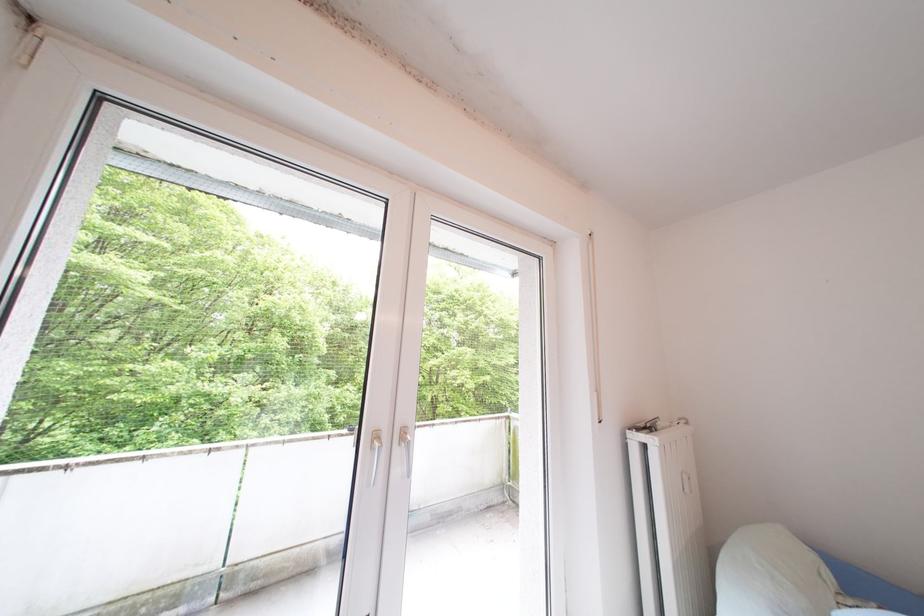
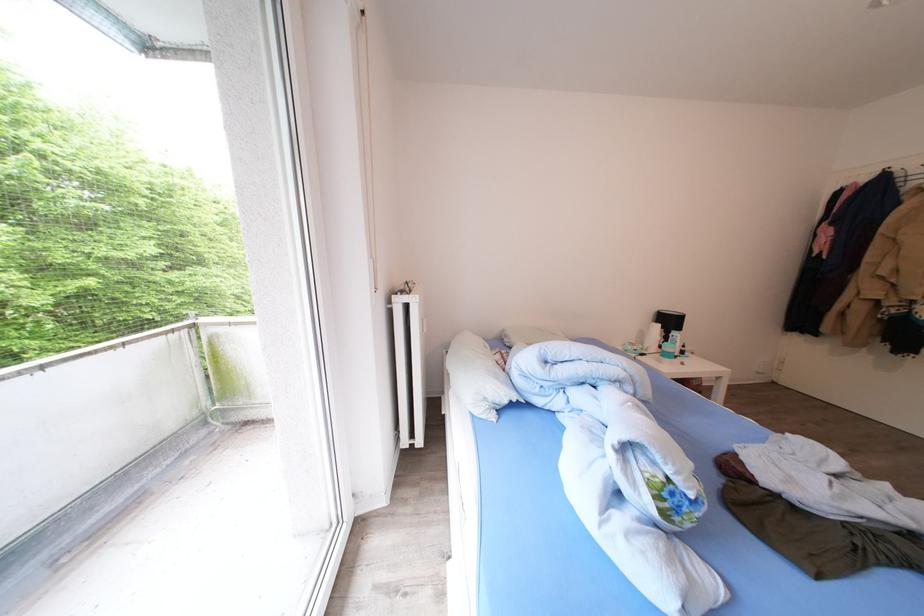
In the second image, find the point that corresponds to point (695, 482) in the first image.

(433, 326)